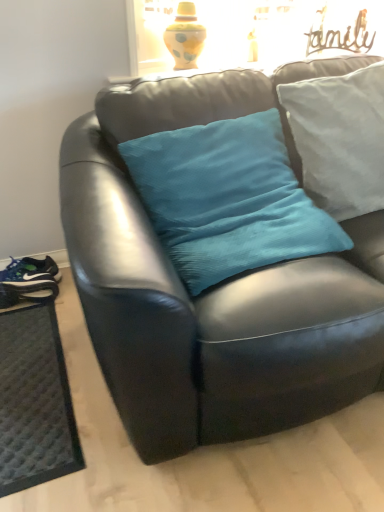
This screenshot has width=384, height=512. I want to click on dark gray textured mat at lower left, so click(x=34, y=401).

Describe the element at coordinates (340, 138) in the screenshot. This screenshot has width=384, height=512. I see `teal fabric pillow at center, the 1th pillow from the right` at that location.

The image size is (384, 512). In order to click on matte black couch at center in this screenshot , I will do `click(213, 287)`.

This screenshot has width=384, height=512. Find the location of `blue synthetic shoe at lower left`. blue synthetic shoe at lower left is located at coordinates (28, 280).

In terms of size, does teal fabric pillow at center, the 1th pillow positioned from the left, appear bigger or smaller than teal fabric pillow at center, which appears as the 2th pillow when viewed from the left?

In the image, teal fabric pillow at center, the 1th pillow positioned from the left, appears to be larger than teal fabric pillow at center, which appears as the 2th pillow when viewed from the left.

Choose the correct answer: Is teal fabric pillow at center, the 1th pillow positioned from the left, inside teal fabric pillow at center, the 1th pillow from the right, or outside it?

teal fabric pillow at center, the 1th pillow positioned from the left, cannot be found inside teal fabric pillow at center, the 1th pillow from the right.

Based on the photo, considering the relative positions of teal fabric pillow at center, which appears as the second pillow when viewed from the right, and teal fabric pillow at center, which appears as the 2th pillow when viewed from the left, in the image provided, is teal fabric pillow at center, which appears as the second pillow when viewed from the right, to the left or to the right of teal fabric pillow at center, which appears as the 2th pillow when viewed from the left,?

teal fabric pillow at center, which appears as the second pillow when viewed from the right, is to the left of teal fabric pillow at center, which appears as the 2th pillow when viewed from the left.

Locate an element on the screen. The width and height of the screenshot is (384, 512). pillow below the teal fabric pillow at center, the 1th pillow from the right (from the image's perspective) is located at coordinates tap(228, 199).

Considering the relative positions of matte black couch at center and teal fabric pillow at center, the 1th pillow positioned from the left, in the image provided, is matte black couch at center to the left of teal fabric pillow at center, the 1th pillow positioned from the left, from the viewer's perspective?

Incorrect, matte black couch at center is not on the left side of teal fabric pillow at center, the 1th pillow positioned from the left.

Is matte black couch at center completely or partially outside of teal fabric pillow at center, the 1th pillow positioned from the left?

Yes, matte black couch at center is located beyond the bounds of teal fabric pillow at center, the 1th pillow positioned from the left.

In terms of height, does matte black couch at center look taller or shorter compared to teal fabric pillow at center, the 1th pillow positioned from the left?

Considering their sizes, matte black couch at center has more height than teal fabric pillow at center, the 1th pillow positioned from the left.

From the image's perspective, is blue synthetic shoe at lower left above matte black running shoe at lower left?

No, from the image's perspective, blue synthetic shoe at lower left is not above matte black running shoe at lower left.

From a real-world perspective, is blue synthetic shoe at lower left under matte black running shoe at lower left?

Yes, from a real-world perspective, blue synthetic shoe at lower left is under matte black running shoe at lower left.

Which object is further away from the camera, blue synthetic shoe at lower left or matte black running shoe at lower left?

matte black running shoe at lower left is more distant.

Between dark gray textured mat at lower left and matte black couch at center, which one has smaller size?

dark gray textured mat at lower left.

From a real-world perspective, is dark gray textured mat at lower left above or below matte black couch at center?

Clearly, from a real-world perspective, dark gray textured mat at lower left is below matte black couch at center.

Can we say dark gray textured mat at lower left lies outside matte black couch at center?

Yes, dark gray textured mat at lower left is not within matte black couch at center.

Between point (6, 453) and point (244, 388), which one is positioned behind?

The point (6, 453) is farther.

From a real-world perspective, which pillow is the 1st one above the matte black running shoe at lower left? Please provide its 2D coordinates.

[(228, 199)]

Is point (56, 272) closer or farther from the camera than point (323, 231)?

Point (56, 272) is farther from the camera than point (323, 231).

Looking at this image, is matte black running shoe at lower left taller or shorter than teal fabric pillow at center, which appears as the second pillow when viewed from the right?

In the image, matte black running shoe at lower left appears to be shorter than teal fabric pillow at center, which appears as the second pillow when viewed from the right.

From the image's perspective, would you say matte black couch at center is positioned over matte black running shoe at lower left?

Yes, from the image's perspective, matte black couch at center is on top of matte black running shoe at lower left.

Between matte black couch at center and matte black running shoe at lower left, which one is positioned in front?

matte black couch at center is in front.

Could you tell me if matte black couch at center is turned towards matte black running shoe at lower left?

No, matte black couch at center is not facing towards matte black running shoe at lower left.

Considering the sizes of objects matte black couch at center and matte black running shoe at lower left in the image provided, who is smaller, matte black couch at center or matte black running shoe at lower left?

matte black running shoe at lower left is smaller.

In the scene shown: Could blue synthetic shoe at lower left be considered to be inside teal fabric pillow at center, which appears as the second pillow when viewed from the right?

No, blue synthetic shoe at lower left is located outside of teal fabric pillow at center, which appears as the second pillow when viewed from the right.

Is teal fabric pillow at center, which appears as the second pillow when viewed from the right, oriented away from blue synthetic shoe at lower left?

No, teal fabric pillow at center, which appears as the second pillow when viewed from the right,'s orientation is not away from blue synthetic shoe at lower left.

Considering the sizes of teal fabric pillow at center, the 1th pillow positioned from the left, and blue synthetic shoe at lower left in the image, is teal fabric pillow at center, the 1th pillow positioned from the left, wider or thinner than blue synthetic shoe at lower left?

Considering their sizes, teal fabric pillow at center, the 1th pillow positioned from the left, looks broader than blue synthetic shoe at lower left.

Considering the sizes of teal fabric pillow at center, the 1th pillow positioned from the left, and blue synthetic shoe at lower left in the image, is teal fabric pillow at center, the 1th pillow positioned from the left, bigger or smaller than blue synthetic shoe at lower left?

In the image, teal fabric pillow at center, the 1th pillow positioned from the left, appears to be larger than blue synthetic shoe at lower left.

Identify the location of pillow lying behind the teal fabric pillow at center, the 1th pillow positioned from the left. (340, 138).

From a real-world perspective, starting from the matte black couch at center, which pillow is the 1st one vertically above it? Please provide its 2D coordinates.

[(228, 199)]

Estimate the real-world distances between objects in this image. Which object is closer to teal fabric pillow at center, the 1th pillow from the right, teal fabric pillow at center, the 1th pillow positioned from the left, or dark gray textured mat at lower left?

Based on the image, teal fabric pillow at center, the 1th pillow positioned from the left, appears to be nearer to teal fabric pillow at center, the 1th pillow from the right.

Which object lies further to the anchor point matte black couch at center, blue synthetic shoe at lower left or teal fabric pillow at center, which appears as the 2th pillow when viewed from the left?

blue synthetic shoe at lower left is further to matte black couch at center.

From the image, which object appears to be nearer to matte black running shoe at lower left, blue synthetic shoe at lower left or teal fabric pillow at center, which appears as the second pillow when viewed from the right?

The object closer to matte black running shoe at lower left is blue synthetic shoe at lower left.

Estimate the real-world distances between objects in this image. Which object is further from matte black running shoe at lower left, dark gray textured mat at lower left or teal fabric pillow at center, which appears as the 2th pillow when viewed from the left?

teal fabric pillow at center, which appears as the 2th pillow when viewed from the left.

When comparing their distances from blue synthetic shoe at lower left, does teal fabric pillow at center, the 1th pillow from the right, or matte black running shoe at lower left seem further?

teal fabric pillow at center, the 1th pillow from the right, is further to blue synthetic shoe at lower left.

When comparing their distances from teal fabric pillow at center, the 1th pillow from the right, does matte black couch at center or dark gray textured mat at lower left seem further?

dark gray textured mat at lower left is further to teal fabric pillow at center, the 1th pillow from the right.

Based on their spatial positions, is dark gray textured mat at lower left or matte black couch at center closer to teal fabric pillow at center, the 1th pillow positioned from the left?

The object closer to teal fabric pillow at center, the 1th pillow positioned from the left, is matte black couch at center.

Estimate the real-world distances between objects in this image. Which object is further from dark gray textured mat at lower left, matte black running shoe at lower left or teal fabric pillow at center, which appears as the second pillow when viewed from the right?

teal fabric pillow at center, which appears as the second pillow when viewed from the right, is positioned further to the anchor dark gray textured mat at lower left.

In order to click on footwear between matte black running shoe at lower left and teal fabric pillow at center, the 1th pillow from the right in this screenshot , I will do `click(28, 280)`.

Identify the location of footwear situated between matte black running shoe at lower left and matte black couch at center from left to right. This screenshot has width=384, height=512. (28, 280).

You are a GUI agent. You are given a task and a screenshot of the screen. Output one action in this format:
    pyautogui.click(x=<x>, y=<y>)
    Task: Click on the pillow between matte black couch at center and teal fabric pillow at center, the 1th pillow from the right, along the z-axis
    Image resolution: width=384 pixels, height=512 pixels.
    Given the screenshot: What is the action you would take?
    pyautogui.click(x=228, y=199)

Identify the location of footwear between teal fabric pillow at center, the 1th pillow positioned from the left, and matte black running shoe at lower left, along the z-axis. (28, 280).